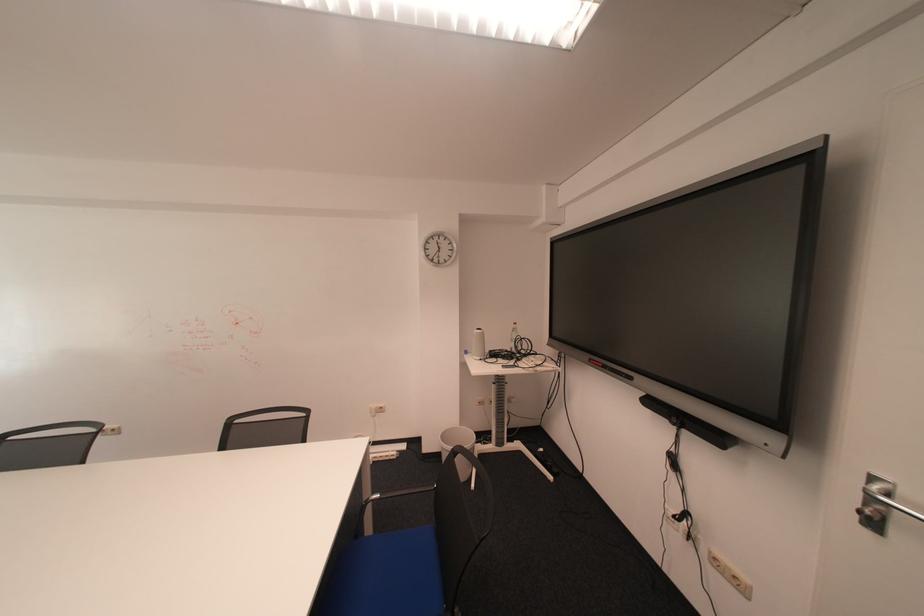
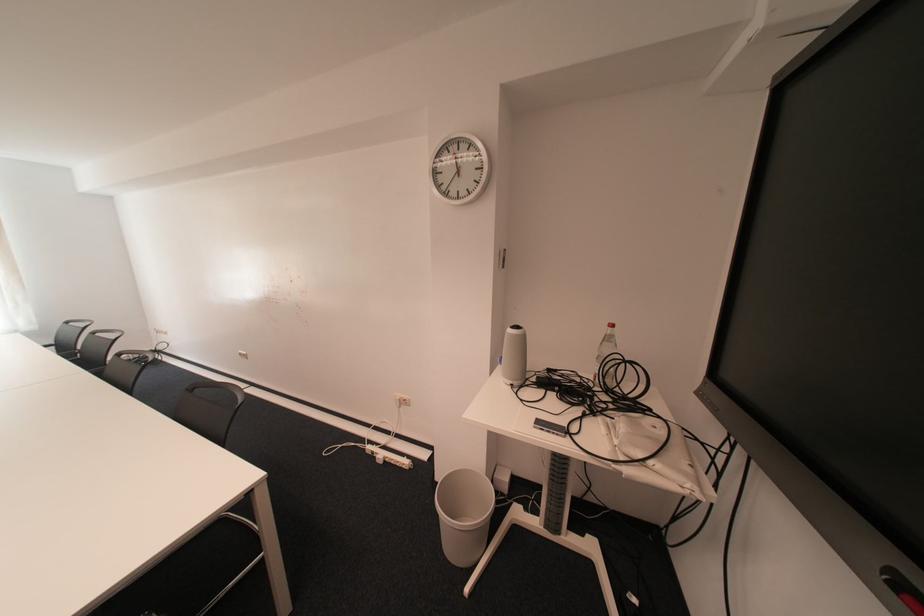
Find the pixel in the second image that matches point 524,331 in the first image.

(614, 341)